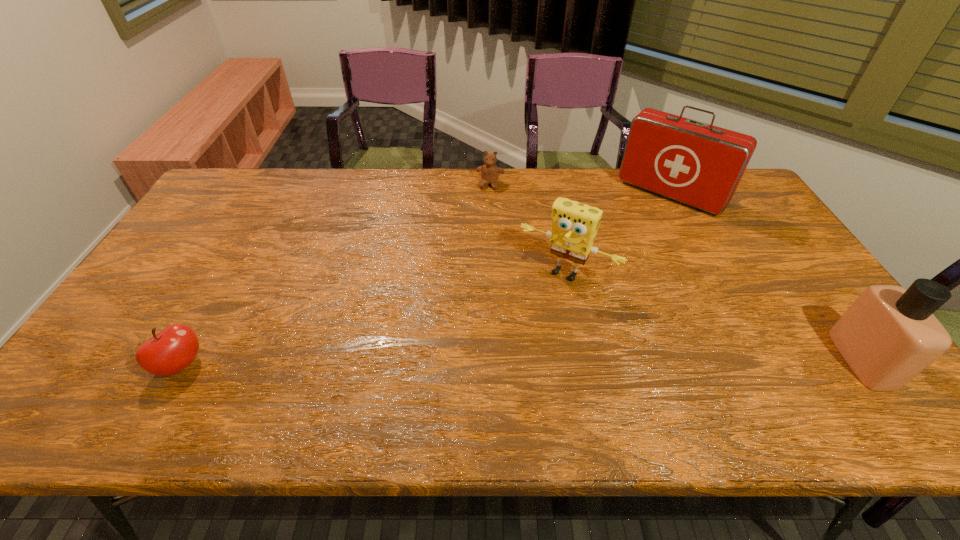
This screenshot has height=540, width=960. I want to click on vacant space located 0.150m on the face of the third object from right to left, so click(x=520, y=328).

At what (x,y) coordinates should I click in order to perform the action: click on free spot located 0.060m on the side of the first-aid kit with the first aid cross symbol. Please return your answer as a coordinate pair (x, y). Looking at the image, I should click on (642, 223).

The height and width of the screenshot is (540, 960). I want to click on vacant space located 0.200m on the side of the first-aid kit with the first aid cross symbol, so click(623, 246).

Where is `vacant space located on the side of the first-aid kit with the first aid cross symbol`? This screenshot has width=960, height=540. vacant space located on the side of the first-aid kit with the first aid cross symbol is located at coordinates click(x=608, y=264).

This screenshot has width=960, height=540. I want to click on vacant area situated 0.310m on the face of the second object from left to right, so click(x=475, y=249).

In order to click on vacant space located 0.160m on the face of the second object from left to right in this screenshot , I will do tap(482, 219).

At what (x,y) coordinates should I click in order to perform the action: click on free space located on the face of the second object from left to right. Please return your answer as a coordinate pair (x, y). This screenshot has width=960, height=540. Looking at the image, I should click on (485, 206).

What are the coordinates of `the first-aid kit present at the far edge` in the screenshot? It's located at (698, 164).

Where is `teddy bear situated at the far edge`? The width and height of the screenshot is (960, 540). teddy bear situated at the far edge is located at coordinates (490, 172).

Locate an element on the screen. The height and width of the screenshot is (540, 960). apple at the near edge is located at coordinates (168, 352).